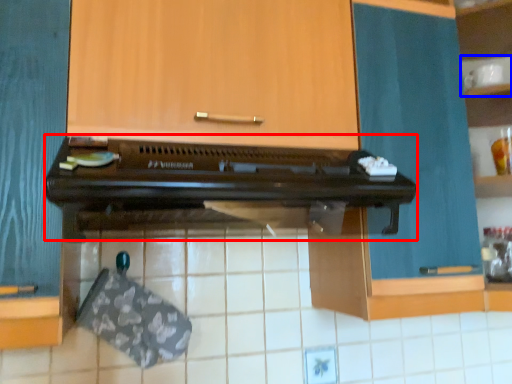
Question: Which object is further to the camera taking this photo, oven (highlighted by a red box) or shelf (highlighted by a blue box)?

Choices:
 (A) oven
 (B) shelf

Answer: (B)